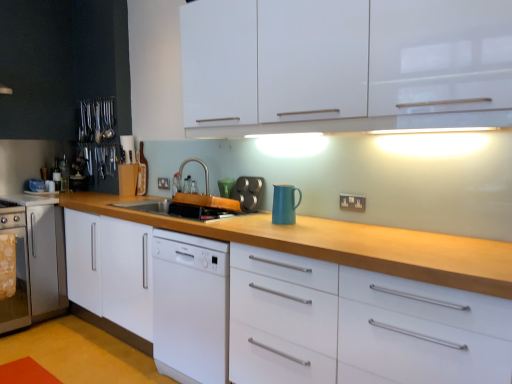
Locate an element on the screen. Image resolution: width=512 pixels, height=384 pixels. empty space that is ontop of white glossy drawer at center (from a real-world perspective) is located at coordinates (410, 237).